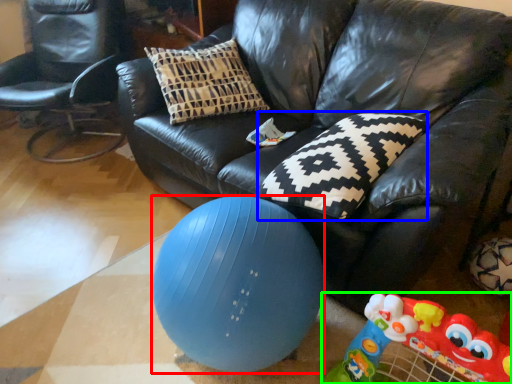
Question: Based on their relative distances, which object is nearer to ball (highlighted by a red box)? Choose from pillow (highlighted by a blue box) and toy (highlighted by a green box).

Choices:
 (A) pillow
 (B) toy

Answer: (A)